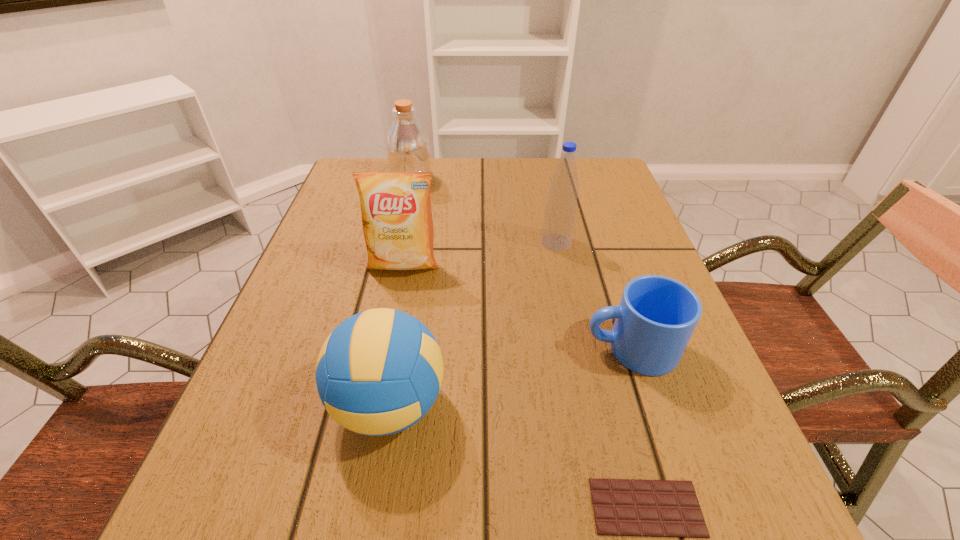
Locate an element on the screen. mug situated at the right edge is located at coordinates (657, 315).

Find the location of a particular element. This screenshot has height=540, width=960. chocolate bar that is at the right edge is located at coordinates (622, 507).

The height and width of the screenshot is (540, 960). Identify the location of object present at the far left corner. (408, 150).

Locate an element on the screen. The image size is (960, 540). object present at the near right corner is located at coordinates (622, 507).

You are a GUI agent. You are given a task and a screenshot of the screen. Output one action in this format:
    pyautogui.click(x=<x>, y=<y>)
    Task: Click on the free region at the far edge of the desktop
    This screenshot has height=540, width=960.
    Given the screenshot: What is the action you would take?
    pyautogui.click(x=432, y=160)

Where is `free space at the near edge of the desktop`? Image resolution: width=960 pixels, height=540 pixels. free space at the near edge of the desktop is located at coordinates (339, 502).

This screenshot has width=960, height=540. Identify the location of free region at the left edge of the desktop. (360, 271).

Where is `free space at the right edge`? Image resolution: width=960 pixels, height=540 pixels. free space at the right edge is located at coordinates (657, 416).

In the image, there is a desktop. What are the coordinates of `free region at the far left corner` in the screenshot? It's located at (348, 180).

What are the coordinates of `vacant region at the far right corner of the desktop` in the screenshot? It's located at (591, 190).